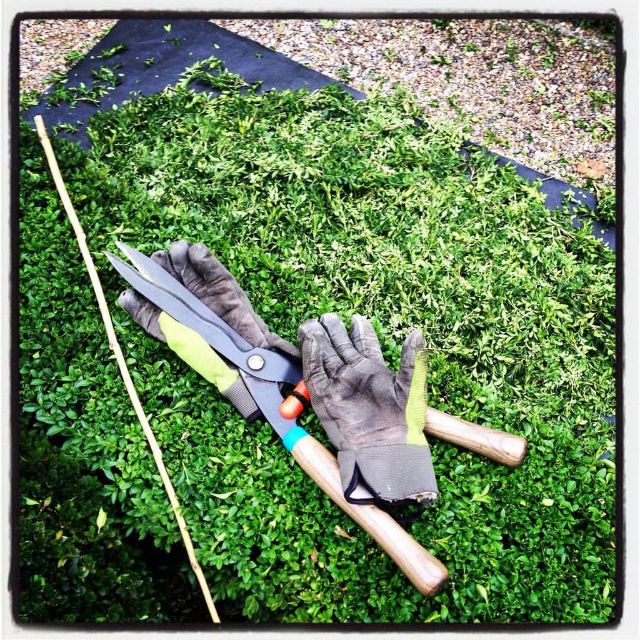
Who is higher up, gray fabric glove at center or metallic shears at center?

gray fabric glove at center is above.

Which is in front, point (355, 385) or point (285, 413)?

Point (355, 385) is more forward.

This screenshot has height=640, width=640. I want to click on gray fabric glove at center, so click(369, 410).

This screenshot has height=640, width=640. Identify the location of gray fabric glove at center. (369, 410).